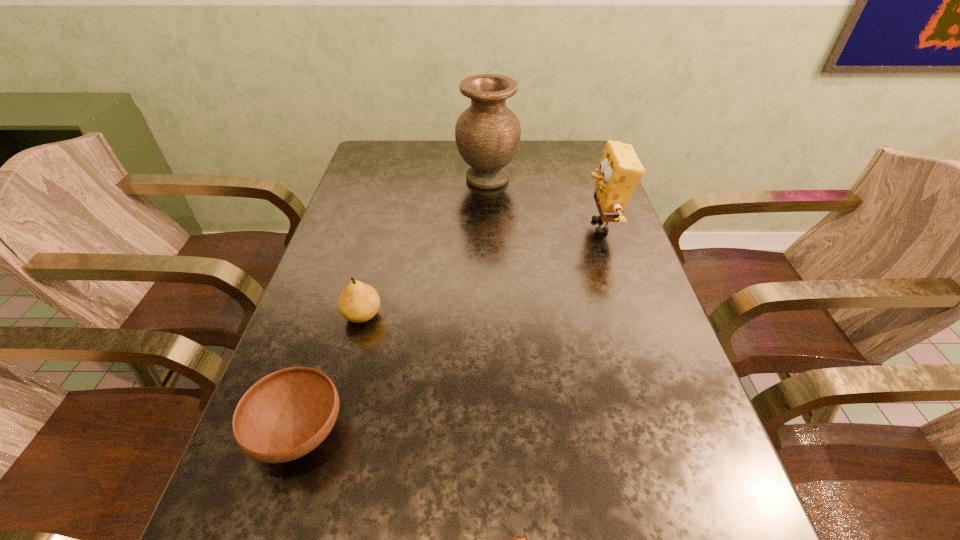
I want to click on vacant region at the right edge of the desktop, so click(x=586, y=251).

Where is `free location at the far left corner`? The image size is (960, 540). free location at the far left corner is located at coordinates (360, 173).

Image resolution: width=960 pixels, height=540 pixels. Identify the location of unoccupied area between the third nearest object and the bowl. (331, 375).

This screenshot has width=960, height=540. Identify the location of empty space that is in between the farthest object and the third shortest object. (425, 247).

The width and height of the screenshot is (960, 540). What are the coordinates of `free point between the pear and the vase` in the screenshot? It's located at (425, 247).

The image size is (960, 540). In order to click on free space between the tallest object and the fourth tallest object in this screenshot , I will do `click(394, 306)`.

What are the coordinates of `vacant area that lies between the third shortest object and the farthest object` in the screenshot? It's located at tap(425, 247).

Identify which object is the closest to the chocolate bar. Please provide its 2D coordinates. Your answer should be formatted as a tuple, i.e. [(x, y)], where the tuple contains the x and y coordinates of a point satisfying the conditions above.

[(285, 415)]

Identify the location of the fourth closest object to the fourth nearest object. (523, 539).